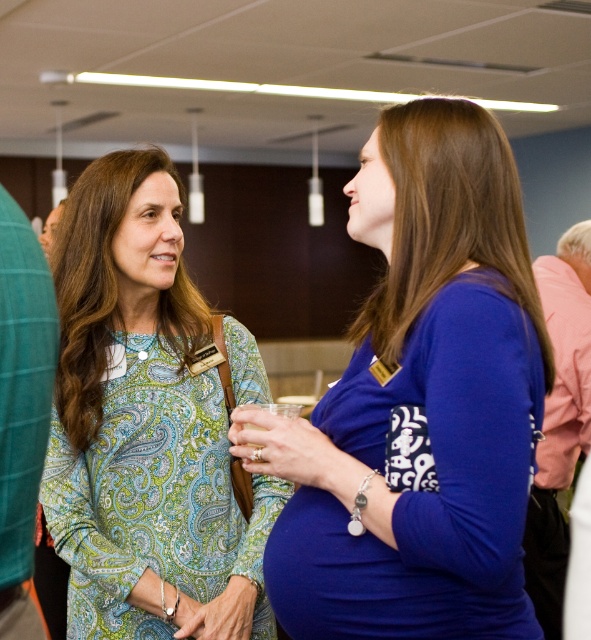
You are at a social event and want to approach the blue fabric dress at center. Based on its position at point coordinates, can you estimate where it is located in the room?

The blue fabric dress at center is located at coordinates point (424,408), which places it near the lower right area of the room.